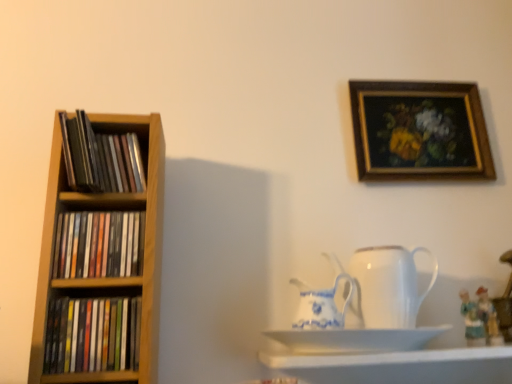
Question: From the image's perspective, is matte wooden shelf at left, which appears as the second book when viewed from the top, located above or below matte ceramic figurine at lower right, which appears as the 2th toy when viewed from the left?

Choices:
 (A) below
 (B) above

Answer: (B)

Question: Considering the positions of matte wooden shelf at left, which appears as the second book when viewed from the top, and matte ceramic figurine at lower right, which appears as the 2th toy when viewed from the left, in the image, is matte wooden shelf at left, which appears as the second book when viewed from the top, wider or thinner than matte ceramic figurine at lower right, which appears as the 2th toy when viewed from the left,?

Choices:
 (A) wide
 (B) thin

Answer: (A)

Question: Which object is positioned farthest from the white porcelain jug at center, the first jug in the left-to-right sequence?

Choices:
 (A) matte ceramic figurine at lower right, placed as the first toy when sorted from right to left
 (B) white ceramic saucer at lower center
 (C) white glossy shelf at lower center
 (D) matte black books at left, which ranks as the first book in bottom-to-top order
 (E) white porcelain jug at center, positioned as the second jug in left-to-right order

Answer: (D)

Question: Estimate the real-world distances between objects in this image. Which object is closer to the matte black books at left, which ranks as the first book in bottom-to-top order?

Choices:
 (A) wooden framed painting at upper right
 (B) matte wooden shelf at left, which appears as the second book when viewed from the top
 (C) white porcelain jug at center, the 2th jug in the right-to-left sequence
 (D) white porcelain jug at center, positioned as the second jug in left-to-right order
 (E) white ceramic saucer at lower center

Answer: (B)